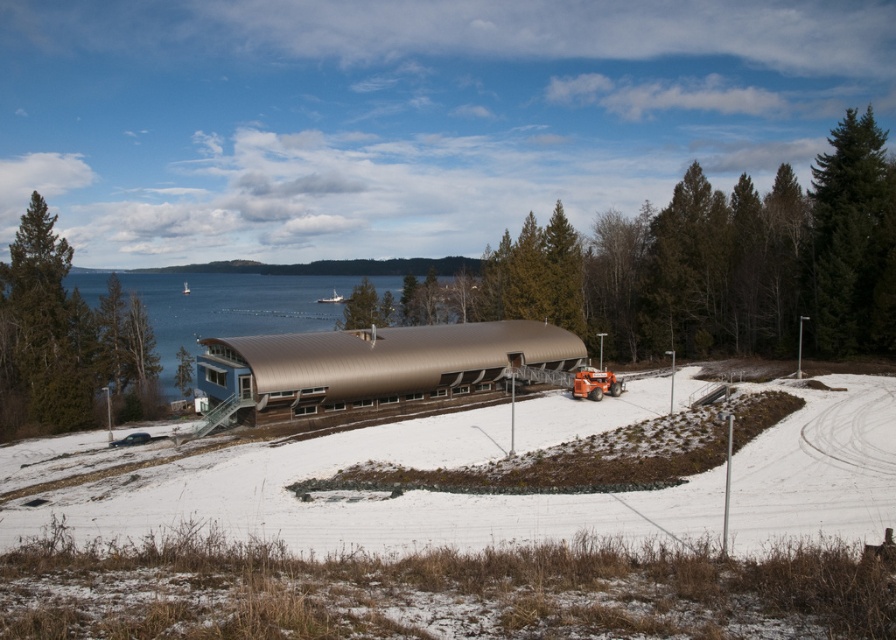
Question: Among these objects, which one is farthest from the camera?

Choices:
 (A) green textured tree at left
 (B) green matte tree at upper center

Answer: (B)

Question: Where is green textured tree at left located in relation to green textured pine tree at right in the image?

Choices:
 (A) left
 (B) right

Answer: (A)

Question: In this image, where is green textured tree at left located relative to green matte tree at upper center?

Choices:
 (A) left
 (B) right

Answer: (A)

Question: Which object is farther from the camera taking this photo?

Choices:
 (A) metallic water at center
 (B) green matte tree at upper center
 (C) green textured pine tree at right
 (D) green textured tree at left

Answer: (B)

Question: Which point appears closest to the camera in this image?

Choices:
 (A) (144, 388)
 (B) (863, 145)
 (C) (188, 326)
 (D) (371, 308)

Answer: (B)

Question: Is green textured pine tree at right closer to the viewer compared to green matte tree at upper center?

Choices:
 (A) yes
 (B) no

Answer: (A)